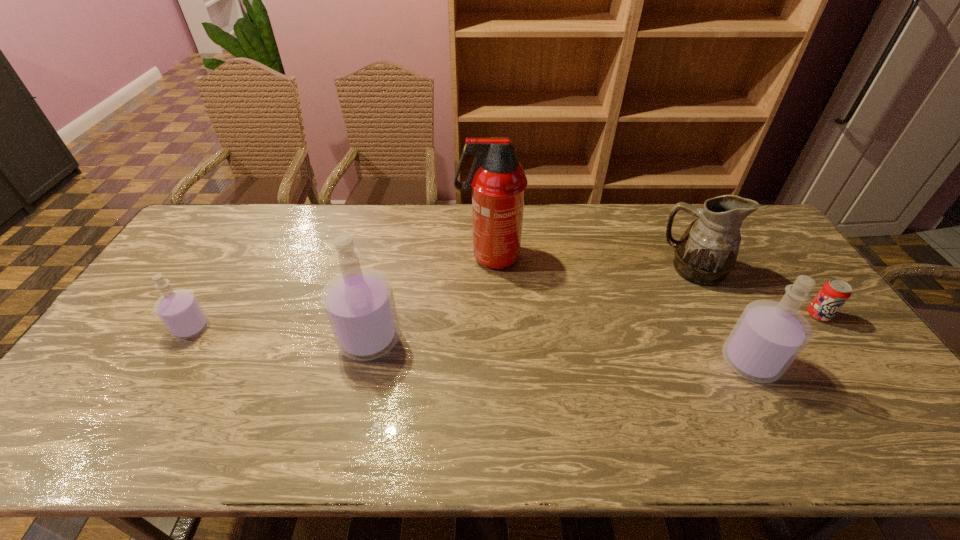
Image resolution: width=960 pixels, height=540 pixels. What are the coordinates of `vacant area in the image that satisfies the following two spatial constraints: 1. from the spout of the pitcher; 2. on the front side of the leftmost object` in the screenshot? It's located at (725, 328).

The image size is (960, 540). Find the location of `vacant area that satisfies the following two spatial constraints: 1. from the spout of the pitcher; 2. on the back side of the rightmost perfume`. vacant area that satisfies the following two spatial constraints: 1. from the spout of the pitcher; 2. on the back side of the rightmost perfume is located at coordinates (742, 362).